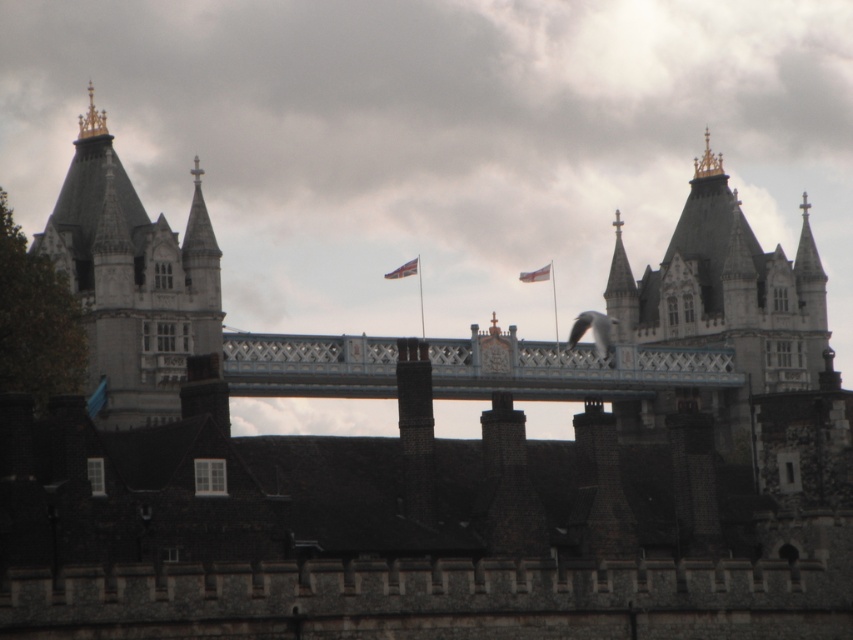
Question: Considering the real-world distances, which object is farthest from the white fabric flag at center?

Choices:
 (A) white painted metal bridge at center
 (B) red fabric flag at center

Answer: (A)

Question: Which point is farther from the camera taking this photo?

Choices:
 (A) (379, 346)
 (B) (537, 276)
 (C) (178, 344)
 (D) (416, 266)

Answer: (D)

Question: Among these points, which one is farthest from the camera?

Choices:
 (A) click(160, 262)
 (B) click(524, 280)

Answer: (B)

Question: Can you confirm if white painted metal bridge at center is wider than white fabric flag at center?

Choices:
 (A) no
 (B) yes

Answer: (B)

Question: Can you confirm if white painted metal bridge at center is positioned to the left of red fabric flag at center?

Choices:
 (A) no
 (B) yes

Answer: (A)

Question: Can you confirm if white painted metal bridge at center is wider than white fabric flag at center?

Choices:
 (A) yes
 (B) no

Answer: (A)